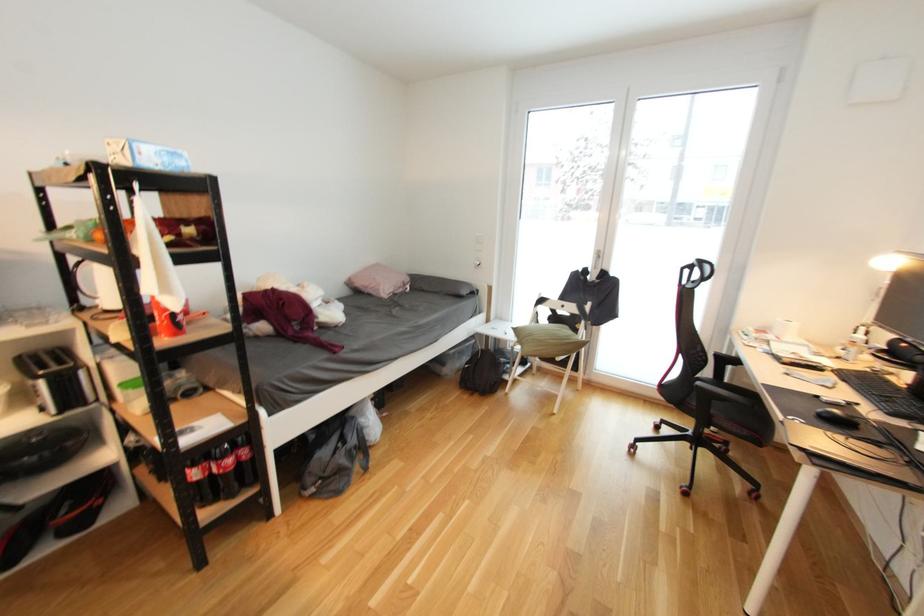
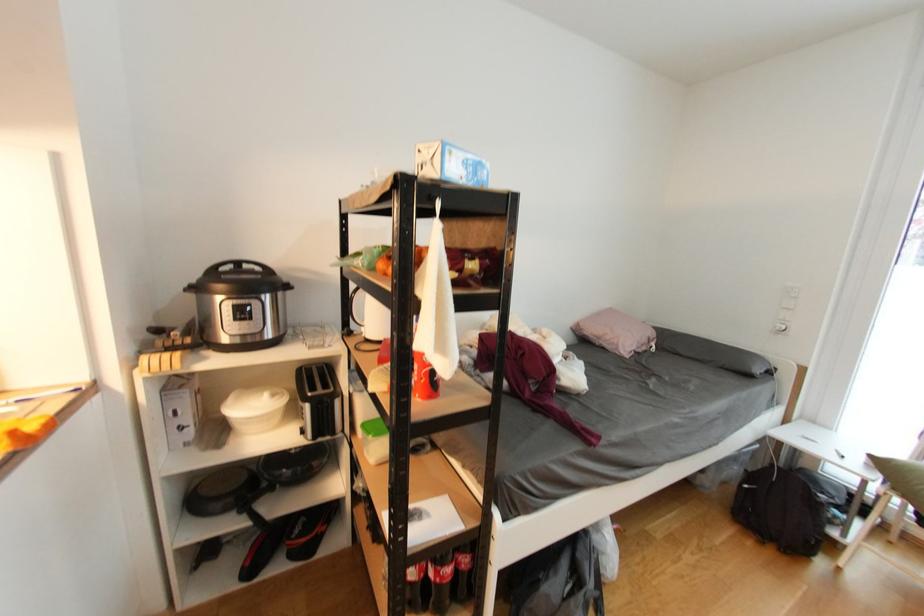
Question: How did the camera likely rotate?

Choices:
 (A) Left
 (B) Right
 (C) Up
 (D) Down

Answer: (A)